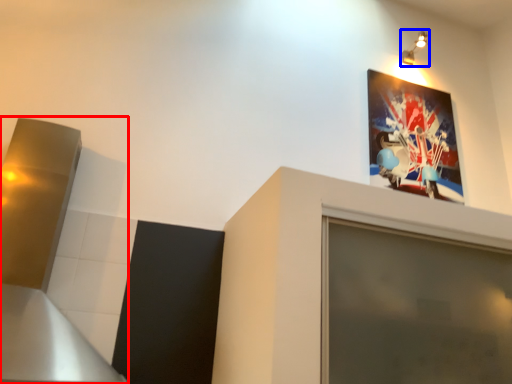
Question: Which object is closer to the camera taking this photo, exhaust hood (highlighted by a red box) or light fixture (highlighted by a blue box)?

Choices:
 (A) exhaust hood
 (B) light fixture

Answer: (A)